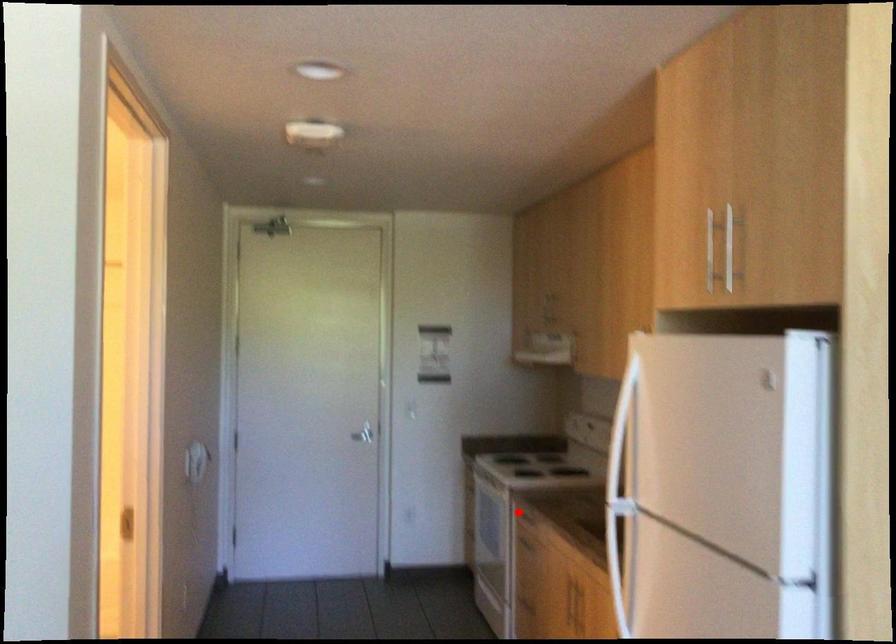
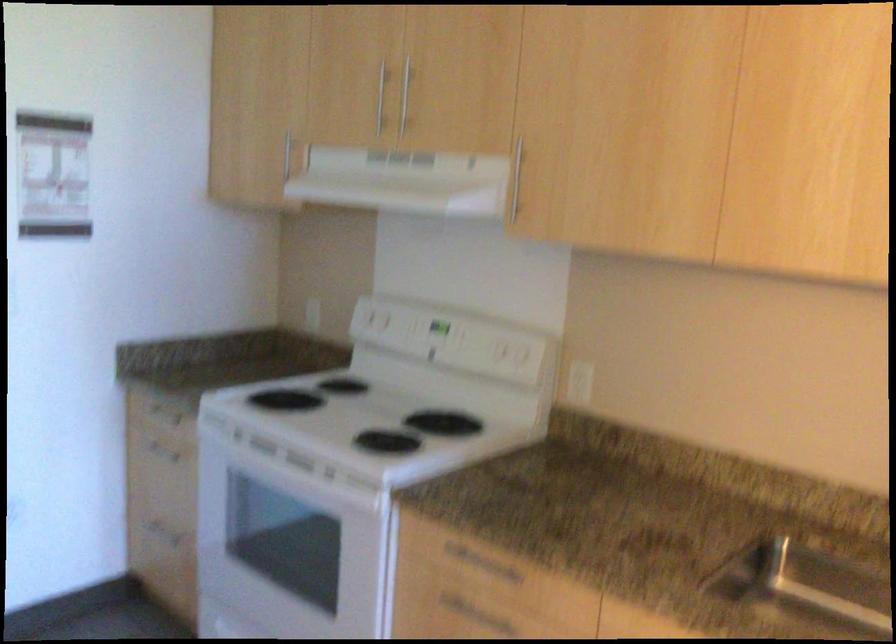
Find the pixel in the second image that matches the highlighted location in the first image.

(385, 571)